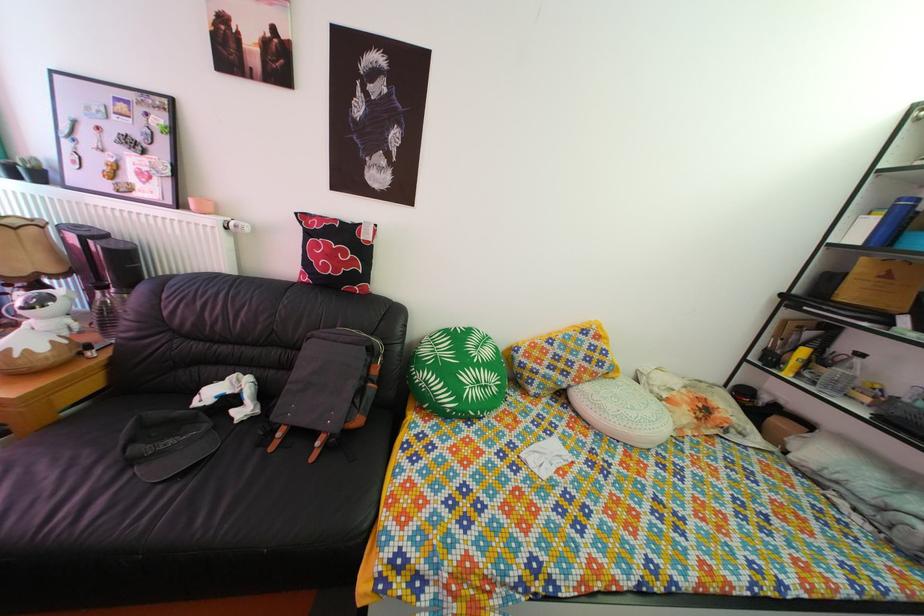
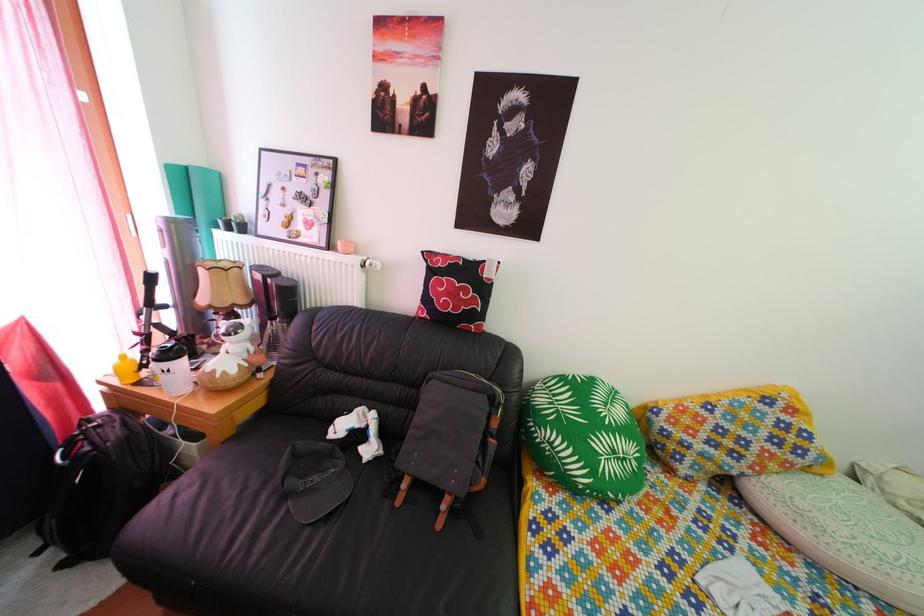
Question: Based on the continuous images, in which direction is the camera rotating? Reply with the corresponding letter.

Choices:
 (A) Left
 (B) Right
 (C) Up
 (D) Down

Answer: (A)